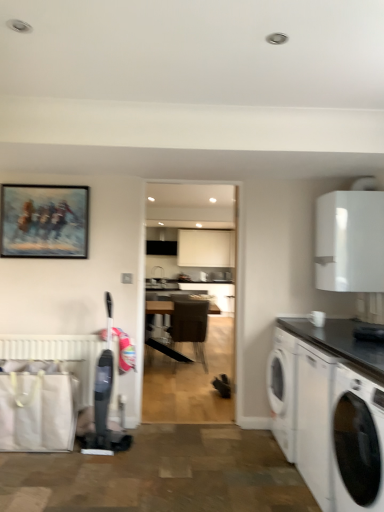
Question: In terms of size, does dark brown leather chair at center appear bigger or smaller than oil painting at upper left?

Choices:
 (A) big
 (B) small

Answer: (A)

Question: Considering the positions of dark brown leather chair at center and oil painting at upper left in the image, is dark brown leather chair at center taller or shorter than oil painting at upper left?

Choices:
 (A) tall
 (B) short

Answer: (A)

Question: Considering the real-world distances, which object is closest to the black granite countertop at right?

Choices:
 (A) dark brown leather chair at center
 (B) white glossy washing machine at lower right
 (C) oil painting at upper left
 (D) white matte cabinet at upper right
 (E) black glossy countertop at lower right

Answer: (E)

Question: Estimate the real-world distances between objects in this image. Which object is closer to the black glossy countertop at lower right?

Choices:
 (A) black granite countertop at right
 (B) oil painting at upper left
 (C) white matte cabinet at upper right
 (D) dark brown leather chair at center
 (E) white matte radiator at lower left

Answer: (A)